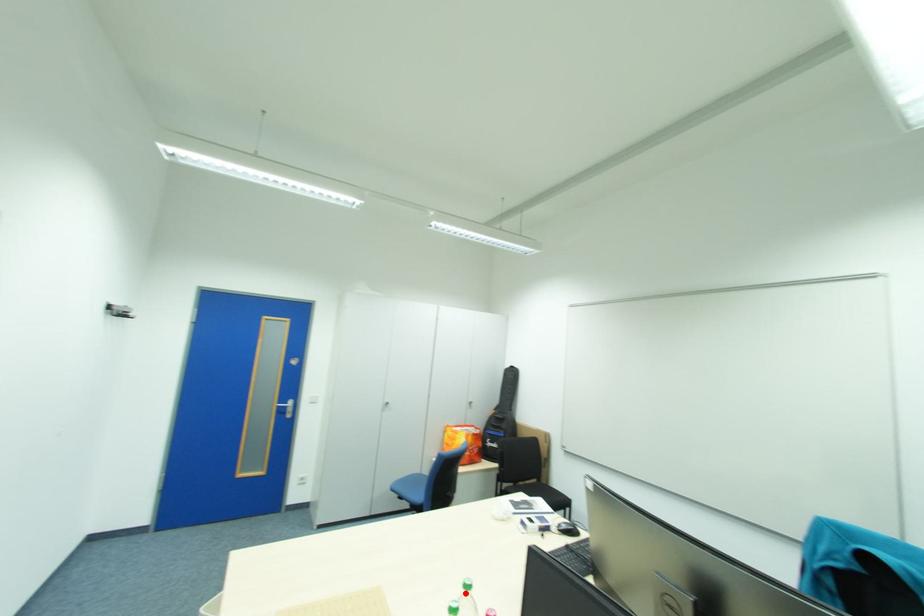
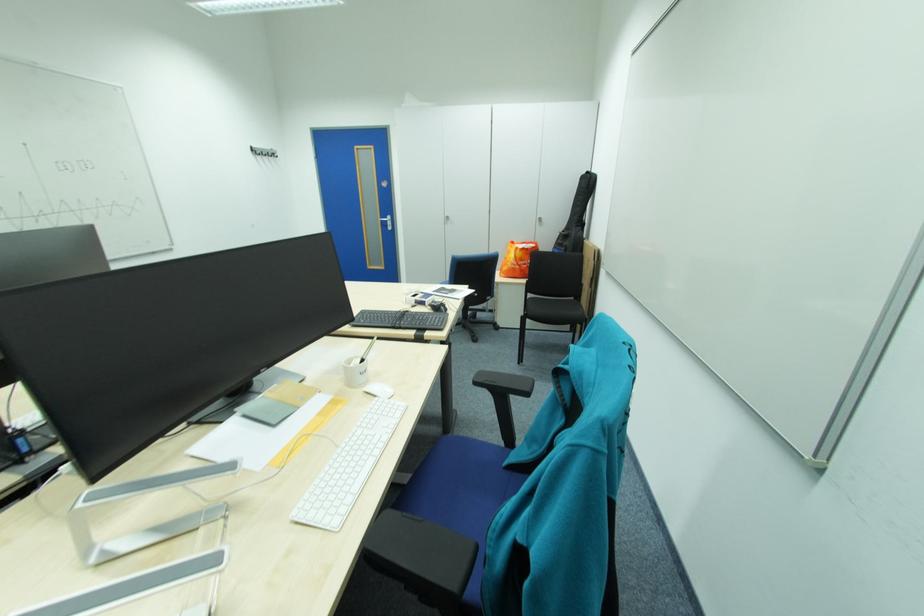
Question: I am providing you with two images of the same scene from different viewpoints. A red point is marked on the first image. Is the red point's position out of view in image 2?

Choices:
 (A) Yes
 (B) No

Answer: (A)